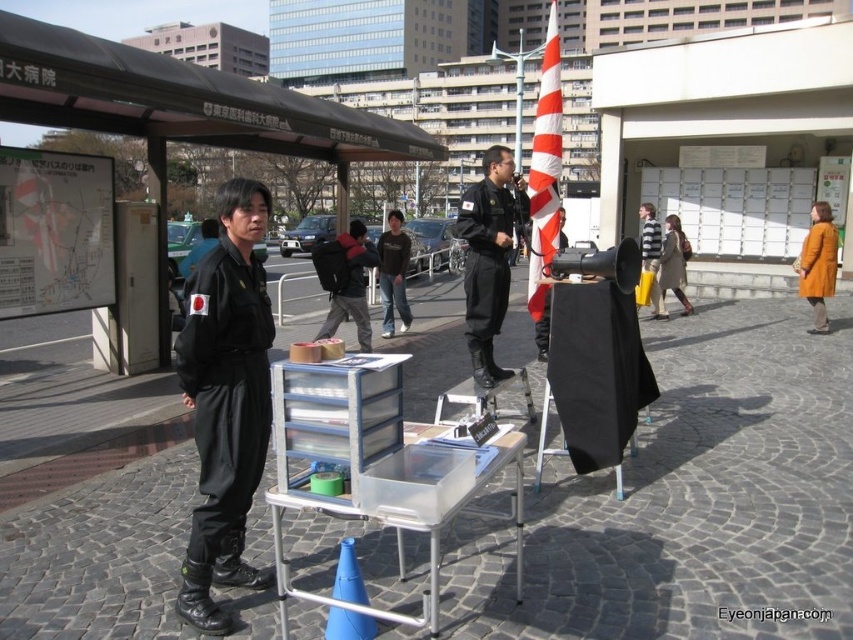
Can you confirm if cobblestone pavement at center is taller than black matte uniform at center?

No.

Is cobblestone pavement at center in front of black matte uniform at center?

No, it is not.

You are a GUI agent. You are given a task and a screenshot of the screen. Output one action in this format:
    pyautogui.click(x=<x>, y=<y>)
    Task: Click on the cobblestone pavement at center
    
    Given the screenshot: What is the action you would take?
    pyautogui.click(x=689, y=499)

In the scene shown: Which is more to the left, dark gray fabric backpack at center or dark blue denim jeans at center?

dark gray fabric backpack at center

Which of these two, dark gray fabric backpack at center or dark blue denim jeans at center, stands shorter?

dark gray fabric backpack at center

Does point (363, 316) come in front of point (383, 273)?

Yes, point (363, 316) is in front of point (383, 273).

This screenshot has width=853, height=640. I want to click on dark gray fabric backpack at center, so click(345, 280).

Which is more to the right, cobblestone pavement at center or dark gray fabric backpack at center?

cobblestone pavement at center

Can you confirm if cobblestone pavement at center is wider than dark gray fabric backpack at center?

Yes.

This screenshot has width=853, height=640. In order to click on cobblestone pavement at center in this screenshot , I will do `click(689, 499)`.

At what (x,y) coordinates should I click in order to perform the action: click on cobblestone pavement at center. Please return your answer as a coordinate pair (x, y). Image resolution: width=853 pixels, height=640 pixels. Looking at the image, I should click on (689, 499).